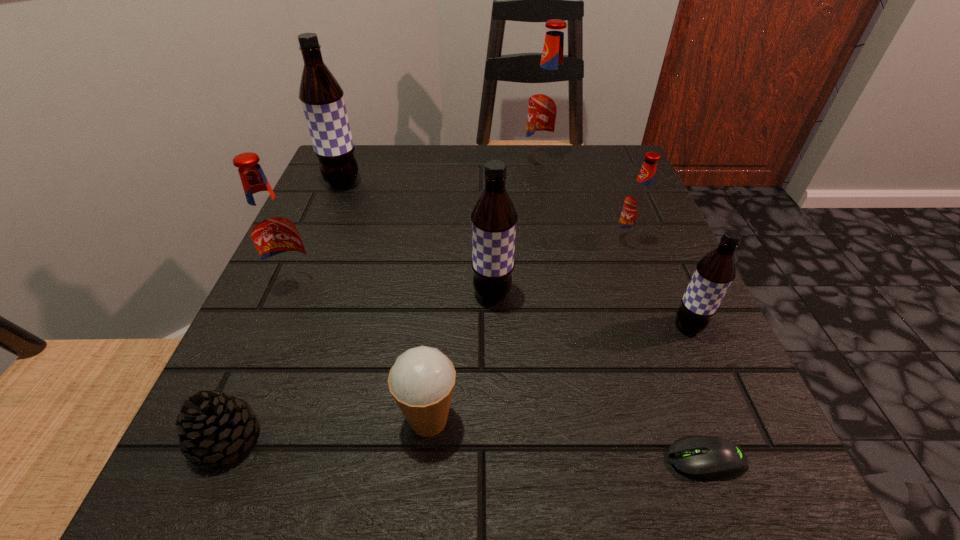
Locate an element on the screen. The width and height of the screenshot is (960, 540). free space located 0.150m on the back of the second smallest red root beer is located at coordinates (323, 220).

Identify the location of free region located 0.310m on the back of the smallest red root beer. The width and height of the screenshot is (960, 540). (595, 153).

Find the location of a particular element. The width and height of the screenshot is (960, 540). vacant space located 0.240m on the left of the sixth farthest object is located at coordinates (516, 326).

At what (x,y) coordinates should I click in order to perform the action: click on vacant region located on the back of the fourth object from left to right. Please return your answer as a coordinate pair (x, y). This screenshot has height=540, width=960. Looking at the image, I should click on (436, 341).

Where is `blank space located on the wheel side of the computer mouse`? The image size is (960, 540). blank space located on the wheel side of the computer mouse is located at coordinates (527, 460).

The height and width of the screenshot is (540, 960). I want to click on vacant region located on the wheel side of the computer mouse, so click(493, 460).

This screenshot has width=960, height=540. What are the coordinates of `free space located on the wheel side of the computer mouse` in the screenshot? It's located at (543, 460).

The height and width of the screenshot is (540, 960). What are the coordinates of `icecream located at the near edge` in the screenshot? It's located at (421, 381).

In order to click on pinecone that is at the near edge in this screenshot , I will do `click(211, 427)`.

I want to click on computer mouse at the near edge, so click(705, 457).